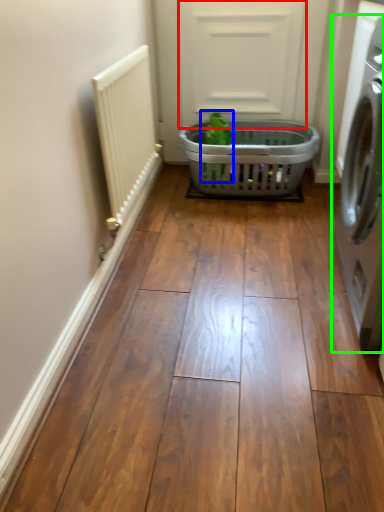
Question: Considering the real-world distances, which object is farthest from screen door (highlighted by a red box)? plant (highlighted by a blue box) or washing machine (highlighted by a green box)?

Choices:
 (A) plant
 (B) washing machine

Answer: (B)